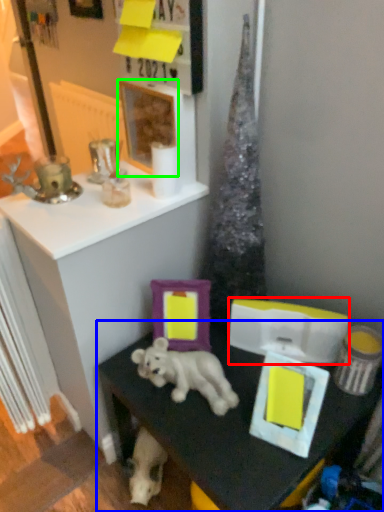
Question: Based on their relative distances, which object is nearer to box (highlighted by a red box)? Choose from table (highlighted by a blue box) and picture frame (highlighted by a green box).

Choices:
 (A) table
 (B) picture frame

Answer: (A)